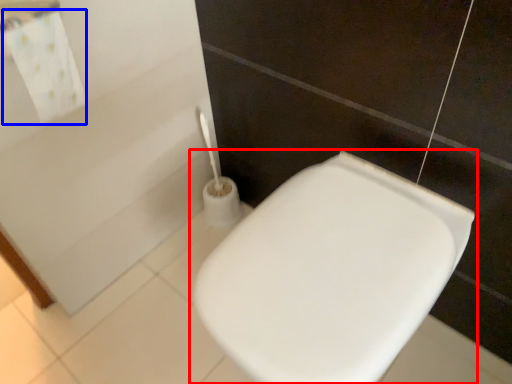
Question: Which of the following is the farthest to the observer, toilet (highlighted by a red box) or bath towel (highlighted by a blue box)?

Choices:
 (A) toilet
 (B) bath towel

Answer: (B)